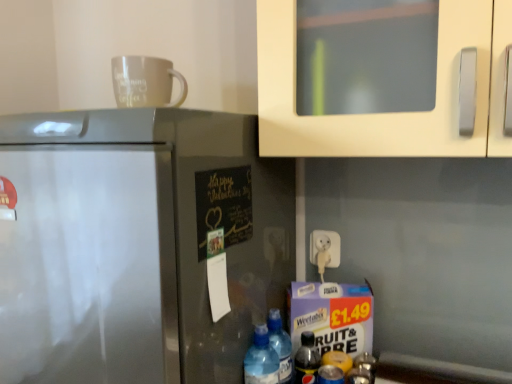
Measure the distance between matte white mug at upper center and camera.

matte white mug at upper center is 34.25 inches away from camera.

In order to face white plastic plug at lower center, should I rotate leftwards or rightwards?

Turn right approximately 9.340 degrees to face it.

What do you see at coordinates (280, 345) in the screenshot? The width and height of the screenshot is (512, 384). I see `translucent plastic bottles at lower center, placed as the third bottle when sorted from right to left` at bounding box center [280, 345].

Identify the location of translucent plastic bottle at lower right, acting as the third bottle starting from the left. This screenshot has width=512, height=384. (307, 360).

The image size is (512, 384). What do you see at coordinates (261, 359) in the screenshot? I see `translucent plastic bottles at lower center, the 4th bottle from the right` at bounding box center [261, 359].

At what (x,y) coordinates should I click in order to perform the action: click on translucent plastic bottle at lower right, the 1th bottle from the right. Please return your answer as a coordinate pair (x, y). This screenshot has width=512, height=384. Looking at the image, I should click on (362, 370).

The height and width of the screenshot is (384, 512). In order to click on chalkboard paper at center in this screenshot , I will do `click(224, 205)`.

From their relative heights in the image, would you say satin silver refrigerator at left is taller or shorter than translucent plastic bottles at lower center, placed as the third bottle when sorted from right to left?

satin silver refrigerator at left is taller than translucent plastic bottles at lower center, placed as the third bottle when sorted from right to left.

Can you see satin silver refrigerator at left touching translucent plastic bottles at lower center, placed as the third bottle when sorted from right to left?

No, satin silver refrigerator at left is not beside translucent plastic bottles at lower center, placed as the third bottle when sorted from right to left.

Considering the relative sizes of satin silver refrigerator at left and translucent plastic bottles at lower center, the 2th bottle positioned from the left, in the image provided, is satin silver refrigerator at left thinner than translucent plastic bottles at lower center, the 2th bottle positioned from the left,?

No.

Can you confirm if satin silver refrigerator at left is bigger than translucent plastic bottles at lower center, placed as the third bottle when sorted from right to left?

Yes.

How different are the orientations of white plastic plug at lower center and translucent plastic bottles at lower center, which ranks as the first bottle in left-to-right order, in degrees?

The angle between the facing direction of white plastic plug at lower center and the facing direction of translucent plastic bottles at lower center, which ranks as the first bottle in left-to-right order, is 2.14 degrees.

Is white plastic plug at lower center far away from translucent plastic bottles at lower center, which ranks as the first bottle in left-to-right order?

Actually, white plastic plug at lower center and translucent plastic bottles at lower center, which ranks as the first bottle in left-to-right order, are a little close together.

Can you confirm if white plastic plug at lower center is wider than translucent plastic bottles at lower center, which ranks as the first bottle in left-to-right order?

Incorrect, the width of white plastic plug at lower center does not surpass that of translucent plastic bottles at lower center, which ranks as the first bottle in left-to-right order.

Considering their positions, is white plastic plug at lower center located in front of or behind translucent plastic bottles at lower center, which ranks as the first bottle in left-to-right order?

Visually, white plastic plug at lower center is located behind translucent plastic bottles at lower center, which ranks as the first bottle in left-to-right order.

Is matte white mug at upper center directly adjacent to translucent plastic bottle at lower right, the 2th bottle in the right-to-left sequence?

matte white mug at upper center is not next to translucent plastic bottle at lower right, the 2th bottle in the right-to-left sequence, and they're not touching.

Is matte white mug at upper center facing away from translucent plastic bottle at lower right, the 2th bottle in the right-to-left sequence?

matte white mug at upper center is not turned away from translucent plastic bottle at lower right, the 2th bottle in the right-to-left sequence.

Who is smaller, matte white mug at upper center or translucent plastic bottle at lower right, the 2th bottle in the right-to-left sequence?

With smaller size is translucent plastic bottle at lower right, the 2th bottle in the right-to-left sequence.

How different are the orientations of matte white mug at upper center and translucent plastic bottle at lower right, acting as the third bottle starting from the left, in degrees?

1.59 degrees separate the facing orientations of matte white mug at upper center and translucent plastic bottle at lower right, acting as the third bottle starting from the left.

Is translucent plastic bottles at lower center, the 4th bottle from the right, inside satin silver refrigerator at left?

That's incorrect, translucent plastic bottles at lower center, the 4th bottle from the right, is not inside satin silver refrigerator at left.

Considering their positions, is satin silver refrigerator at left located in front of or behind translucent plastic bottles at lower center, which ranks as the first bottle in left-to-right order?

Clearly, satin silver refrigerator at left is in front of translucent plastic bottles at lower center, which ranks as the first bottle in left-to-right order.

Between satin silver refrigerator at left and translucent plastic bottles at lower center, which ranks as the first bottle in left-to-right order, which one appears on the left side from the viewer's perspective?

Positioned to the left is satin silver refrigerator at left.

Is satin silver refrigerator at left oriented towards translucent plastic bottles at lower center, the 4th bottle from the right?

No, satin silver refrigerator at left is not turned towards translucent plastic bottles at lower center, the 4th bottle from the right.

Is white plastic plug at lower center to the right of translucent plastic bottles at lower center, the 2th bottle positioned from the left, from the viewer's perspective?

Yes, white plastic plug at lower center is to the right of translucent plastic bottles at lower center, the 2th bottle positioned from the left.

Who is taller, white plastic plug at lower center or translucent plastic bottles at lower center, placed as the third bottle when sorted from right to left?

translucent plastic bottles at lower center, placed as the third bottle when sorted from right to left, is taller.

Based on their sizes in the image, would you say white plastic plug at lower center is bigger or smaller than translucent plastic bottles at lower center, the 2th bottle positioned from the left?

Considering their sizes, white plastic plug at lower center takes up less space than translucent plastic bottles at lower center, the 2th bottle positioned from the left.

Considering the relative sizes of white plastic plug at lower center and translucent plastic bottles at lower center, placed as the third bottle when sorted from right to left, in the image provided, is white plastic plug at lower center wider than translucent plastic bottles at lower center, placed as the third bottle when sorted from right to left,?

No.

From the image's perspective, would you say translucent plastic bottles at lower center, placed as the third bottle when sorted from right to left, is shown under translucent plastic bottles at lower center, which ranks as the first bottle in left-to-right order?

Incorrect, from the image's perspective, translucent plastic bottles at lower center, placed as the third bottle when sorted from right to left, is higher than translucent plastic bottles at lower center, which ranks as the first bottle in left-to-right order.

Can you confirm if translucent plastic bottles at lower center, placed as the third bottle when sorted from right to left, is wider than translucent plastic bottles at lower center, which ranks as the first bottle in left-to-right order?

In fact, translucent plastic bottles at lower center, placed as the third bottle when sorted from right to left, might be narrower than translucent plastic bottles at lower center, which ranks as the first bottle in left-to-right order.

Which of these two, translucent plastic bottles at lower center, the 2th bottle positioned from the left, or translucent plastic bottles at lower center, which ranks as the first bottle in left-to-right order, is smaller?

With smaller size is translucent plastic bottles at lower center, which ranks as the first bottle in left-to-right order.

Is translucent plastic bottles at lower center, the 2th bottle positioned from the left, not within translucent plastic bottles at lower center, the 4th bottle from the right?

Yes, translucent plastic bottles at lower center, the 2th bottle positioned from the left, is outside of translucent plastic bottles at lower center, the 4th bottle from the right.

Is chalkboard paper at center facing towards translucent plastic bottle at lower right, the 2th bottle in the right-to-left sequence?

No.

At what (x,y) coordinates should I click in order to perform the action: click on bulletin board above the translucent plastic bottle at lower right, the 2th bottle in the right-to-left sequence (from a real-world perspective). Please return your answer as a coordinate pair (x, y). Looking at the image, I should click on (224, 205).

From a real-world perspective, is chalkboard paper at center positioned under translucent plastic bottle at lower right, the 2th bottle in the right-to-left sequence, based on gravity?

No, from a real-world perspective, chalkboard paper at center is not below translucent plastic bottle at lower right, the 2th bottle in the right-to-left sequence.

Is chalkboard paper at center wider than translucent plastic bottle at lower right, acting as the third bottle starting from the left?

In fact, chalkboard paper at center might be narrower than translucent plastic bottle at lower right, acting as the third bottle starting from the left.

You are a GUI agent. You are given a task and a screenshot of the screen. Output one action in this format:
    pyautogui.click(x=<x>, y=<y>)
    Task: Click on the refrigerator above the translucent plastic bottles at lower center, placed as the third bottle when sorted from right to left (from the image's perspective)
    The image size is (512, 384).
    Given the screenshot: What is the action you would take?
    pyautogui.click(x=136, y=244)

You are a GUI agent. You are given a task and a screenshot of the screen. Output one action in this format:
    pyautogui.click(x=<x>, y=<y>)
    Task: Click on the electric outlet that is behind the translucent plastic bottles at lower center, the 4th bottle from the right
    The image size is (512, 384).
    Given the screenshot: What is the action you would take?
    pyautogui.click(x=328, y=248)

In the scene shown: From the image, which object appears to be nearer to satin silver refrigerator at left, translucent plastic bottles at lower center, the 2th bottle positioned from the left, or matte white mug at upper center?

translucent plastic bottles at lower center, the 2th bottle positioned from the left, is closer to satin silver refrigerator at left.

From the image, which object appears to be farther from translucent plastic bottles at lower center, which ranks as the first bottle in left-to-right order, satin silver refrigerator at left or chalkboard paper at center?

Among the two, satin silver refrigerator at left is located further to translucent plastic bottles at lower center, which ranks as the first bottle in left-to-right order.

Estimate the real-world distances between objects in this image. Which object is closer to matte white mug at upper center, translucent plastic bottle at lower right, acting as the third bottle starting from the left, or white plastic plug at lower center?

The object closer to matte white mug at upper center is white plastic plug at lower center.

Based on the photo, estimate the real-world distances between objects in this image. Which object is closer to translucent plastic bottle at lower right, the 1th bottle from the right, translucent plastic bottle at lower right, the 2th bottle in the right-to-left sequence, or matte white mug at upper center?

translucent plastic bottle at lower right, the 2th bottle in the right-to-left sequence, is positioned closer to the anchor translucent plastic bottle at lower right, the 1th bottle from the right.

From the image, which object appears to be farther from matte white mug at upper center, translucent plastic bottle at lower right, acting as the third bottle starting from the left, or translucent plastic bottles at lower center, the 2th bottle positioned from the left?

The object further to matte white mug at upper center is translucent plastic bottle at lower right, acting as the third bottle starting from the left.

Consider the image. Looking at the image, which one is located closer to translucent plastic bottles at lower center, the 4th bottle from the right, satin silver refrigerator at left or matte white mug at upper center?

satin silver refrigerator at left is closer to translucent plastic bottles at lower center, the 4th bottle from the right.

Estimate the real-world distances between objects in this image. Which object is further from translucent plastic bottles at lower center, the 4th bottle from the right, chalkboard paper at center or translucent plastic bottle at lower right, marked as the 4th bottle in a left-to-right arrangement?

chalkboard paper at center is positioned further to the anchor translucent plastic bottles at lower center, the 4th bottle from the right.

When comparing their distances from translucent plastic bottle at lower right, marked as the 4th bottle in a left-to-right arrangement, does white plastic plug at lower center or translucent plastic bottles at lower center, placed as the third bottle when sorted from right to left, seem further?

Among the two, white plastic plug at lower center is located further to translucent plastic bottle at lower right, marked as the 4th bottle in a left-to-right arrangement.

You are a GUI agent. You are given a task and a screenshot of the screen. Output one action in this format:
    pyautogui.click(x=<x>, y=<y>)
    Task: Click on the electric outlet between matte white mug at upper center and translucent plastic bottle at lower right, acting as the third bottle starting from the left, in the up-down direction
    This screenshot has height=384, width=512.
    Given the screenshot: What is the action you would take?
    pyautogui.click(x=328, y=248)

This screenshot has height=384, width=512. I want to click on bulletin board between satin silver refrigerator at left and translucent plastic bottle at lower right, marked as the 4th bottle in a left-to-right arrangement, from left to right, so click(x=224, y=205).

Where is `bulletin board between matte white mug at upper center and satin silver refrigerator at left from top to bottom`? Image resolution: width=512 pixels, height=384 pixels. bulletin board between matte white mug at upper center and satin silver refrigerator at left from top to bottom is located at coordinates (224, 205).

Locate an element on the screen. The height and width of the screenshot is (384, 512). bulletin board between matte white mug at upper center and translucent plastic bottles at lower center, the 4th bottle from the right, vertically is located at coordinates (224, 205).